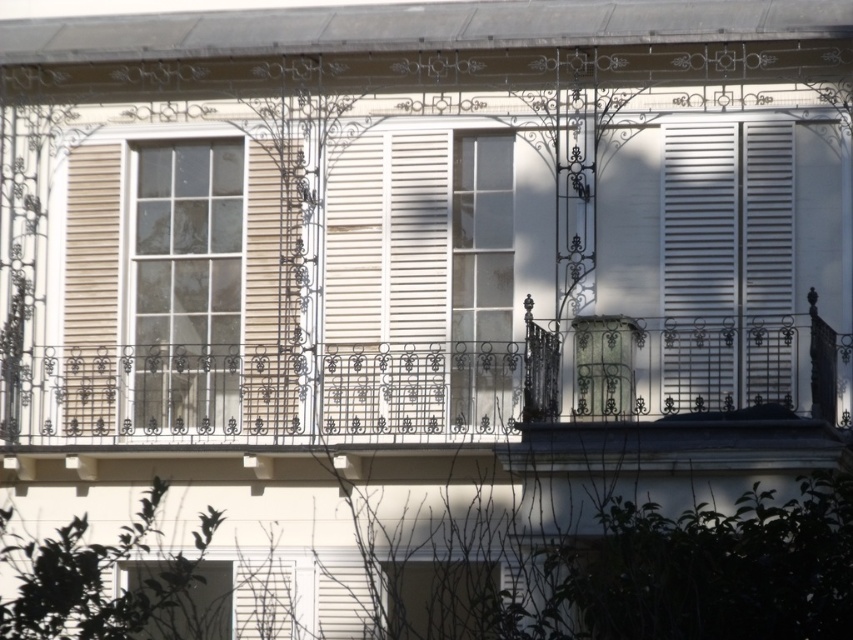
Who is taller, white matte shutter at center or white glass window at center?

white glass window at center is taller.

Does white matte shutter at center have a smaller size compared to white glass window at center?

No.

In order to click on white matte shutter at center in this screenshot , I will do `click(387, 280)`.

Is white glass window at center taller than beige matte shutter at left?

Indeed, white glass window at center has a greater height compared to beige matte shutter at left.

Can you confirm if white glass window at center is positioned below beige matte shutter at left?

No.

At what (x,y) coordinates should I click in order to perform the action: click on white glass window at center. Please return your answer as a coordinate pair (x, y). This screenshot has width=853, height=640. Looking at the image, I should click on (187, 284).

This screenshot has width=853, height=640. What are the coordinates of `white glass window at center` in the screenshot? It's located at coord(187,284).

Is white matte shutters at right below white glass window at center?

Indeed, white matte shutters at right is positioned under white glass window at center.

Who is shorter, white matte shutters at right or white glass window at center?

white matte shutters at right is shorter.

Does point (666, 376) come behind point (242, 170)?

No.

Locate an element on the screen. white matte shutters at right is located at coordinates (726, 262).